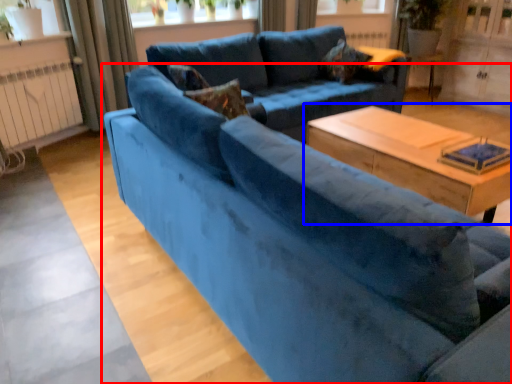
Question: Which object appears closest to the camera in this image, studio couch (highlighted by a red box) or table (highlighted by a blue box)?

Choices:
 (A) studio couch
 (B) table

Answer: (A)